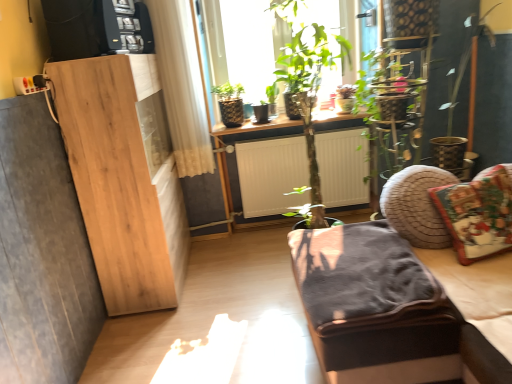
Question: From the image's perspective, relative to velvet dark gray studio couch at lower right, is christmas-patterned fabric pillow at right above or below?

Choices:
 (A) below
 (B) above

Answer: (B)

Question: Relative to velvet dark gray studio couch at lower right, is christmas-patterned fabric pillow at right in front or behind?

Choices:
 (A) behind
 (B) front

Answer: (A)

Question: Choose the correct answer: Is christmas-patterned fabric pillow at right inside velvet dark gray studio couch at lower right or outside it?

Choices:
 (A) inside
 (B) outside

Answer: (A)

Question: Visually, is velvet dark gray studio couch at lower right positioned to the left or to the right of christmas-patterned fabric pillow at right?

Choices:
 (A) right
 (B) left

Answer: (B)

Question: In terms of size, does velvet dark gray studio couch at lower right appear bigger or smaller than christmas-patterned fabric pillow at right?

Choices:
 (A) small
 (B) big

Answer: (B)

Question: Is point (492, 380) positioned closer to the camera than point (505, 178)?

Choices:
 (A) farther
 (B) closer

Answer: (B)

Question: Considering the positions of velvet dark gray studio couch at lower right and christmas-patterned fabric pillow at right in the image, is velvet dark gray studio couch at lower right taller or shorter than christmas-patterned fabric pillow at right?

Choices:
 (A) short
 (B) tall

Answer: (B)